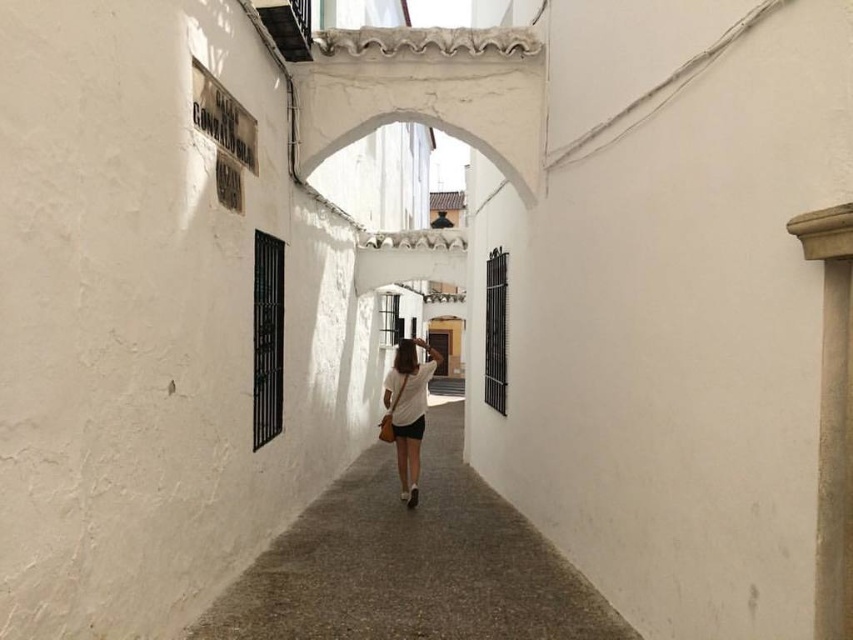
Is the position of smooth concrete path at center less distant than that of white cotton shirt at center?

Yes, it is in front of white cotton shirt at center.

Does smooth concrete path at center appear on the right side of white cotton shirt at center?

Yes, smooth concrete path at center is to the right of white cotton shirt at center.

From the picture: Measure the distance between smooth concrete path at center and camera.

smooth concrete path at center is 12.86 feet away from camera.

Identify the location of smooth concrete path at center. This screenshot has width=853, height=640. (410, 563).